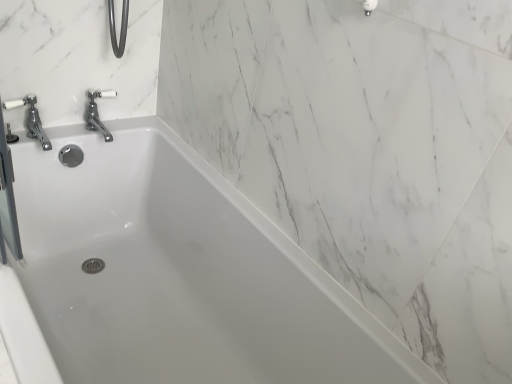
Question: From a real-world perspective, is white glossy bathtub at center under chrome/polished metal faucet at upper left?

Choices:
 (A) yes
 (B) no

Answer: (A)

Question: Can you confirm if white glossy bathtub at center is shorter than chrome/polished metal faucet at upper left?

Choices:
 (A) yes
 (B) no

Answer: (B)

Question: Can you confirm if white glossy bathtub at center is smaller than chrome/polished metal faucet at upper left?

Choices:
 (A) yes
 (B) no

Answer: (B)

Question: Does white glossy bathtub at center have a greater height compared to chrome/polished metal faucet at upper left?

Choices:
 (A) yes
 (B) no

Answer: (A)

Question: From the image's perspective, is white glossy bathtub at center beneath chrome/polished metal faucet at upper left?

Choices:
 (A) no
 (B) yes

Answer: (B)

Question: Is chrome/polished metal faucet at upper left at the back of white glossy bathtub at center?

Choices:
 (A) no
 (B) yes

Answer: (A)

Question: Could you tell me if chrome/polished metal faucet at upper left is turned towards white glossy bathtub at center?

Choices:
 (A) yes
 (B) no

Answer: (B)

Question: Considering the relative positions of chrome/polished metal faucet at upper left and white glossy bathtub at center in the image provided, is chrome/polished metal faucet at upper left in front of white glossy bathtub at center?

Choices:
 (A) no
 (B) yes

Answer: (A)

Question: From the image's perspective, does chrome/polished metal faucet at upper left appear lower than white glossy bathtub at center?

Choices:
 (A) yes
 (B) no

Answer: (B)

Question: Is the position of chrome/polished metal faucet at upper left more distant than that of white glossy bathtub at center?

Choices:
 (A) yes
 (B) no

Answer: (A)

Question: Is chrome/polished metal faucet at upper left at the right side of white glossy bathtub at center?

Choices:
 (A) yes
 (B) no

Answer: (B)

Question: From the image's perspective, is chrome/polished metal faucet at upper left above white glossy bathtub at center?

Choices:
 (A) yes
 (B) no

Answer: (A)

Question: Considering the positions of point (126, 268) and point (41, 140), is point (126, 268) closer or farther from the camera than point (41, 140)?

Choices:
 (A) closer
 (B) farther

Answer: (B)